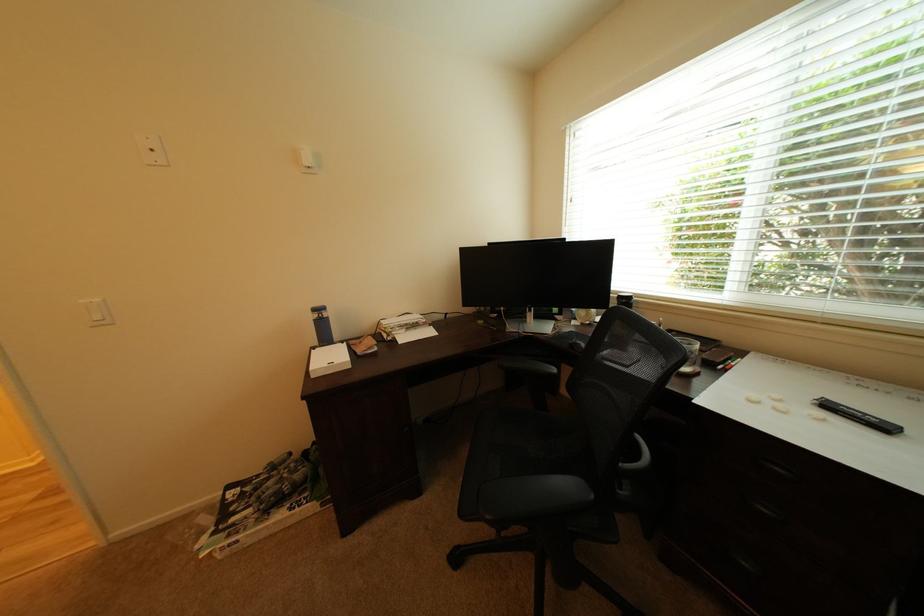
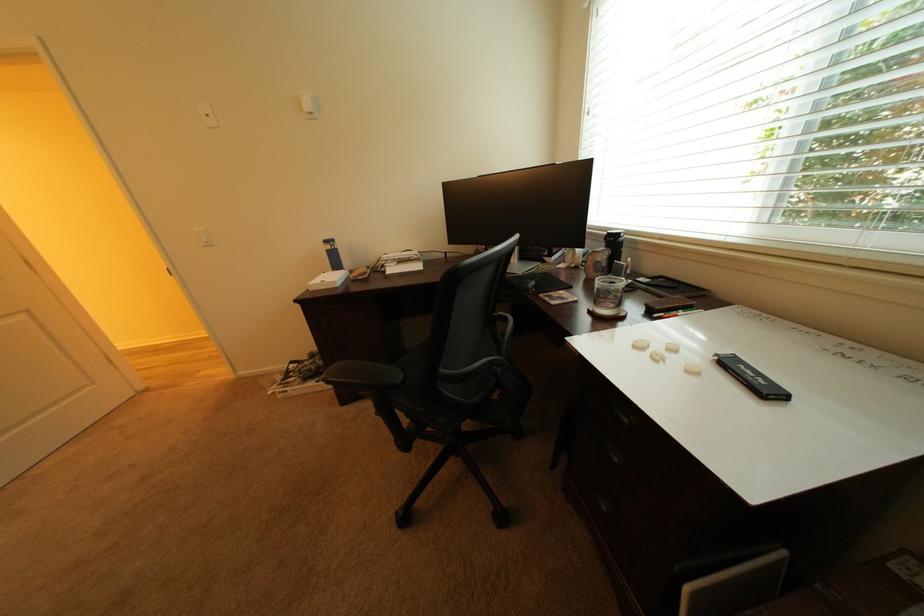
Question: What movement of the cameraman would produce the second image?

Choices:
 (A) Left
 (B) Right
 (C) Forward
 (D) Backward

Answer: (B)